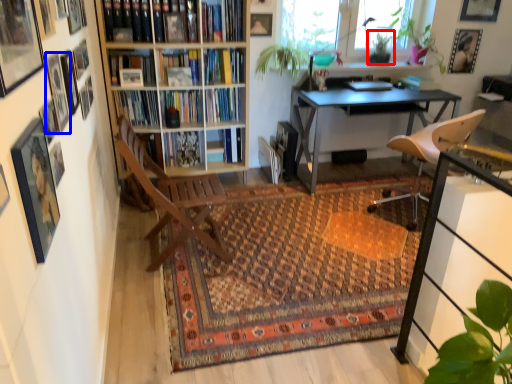
Question: Which point is closer to the camera, plant (highlighted by a red box) or picture frame (highlighted by a blue box)?

Choices:
 (A) plant
 (B) picture frame

Answer: (B)